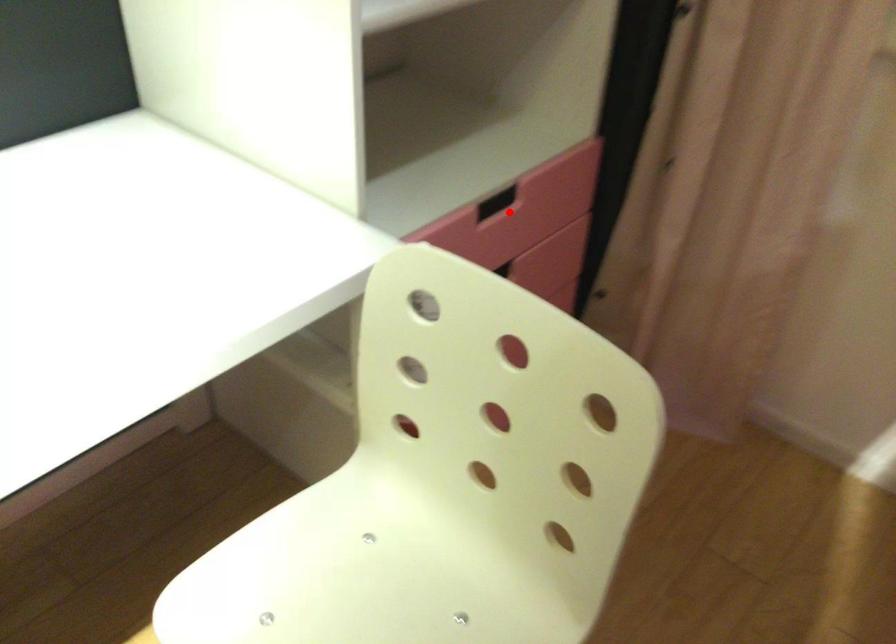
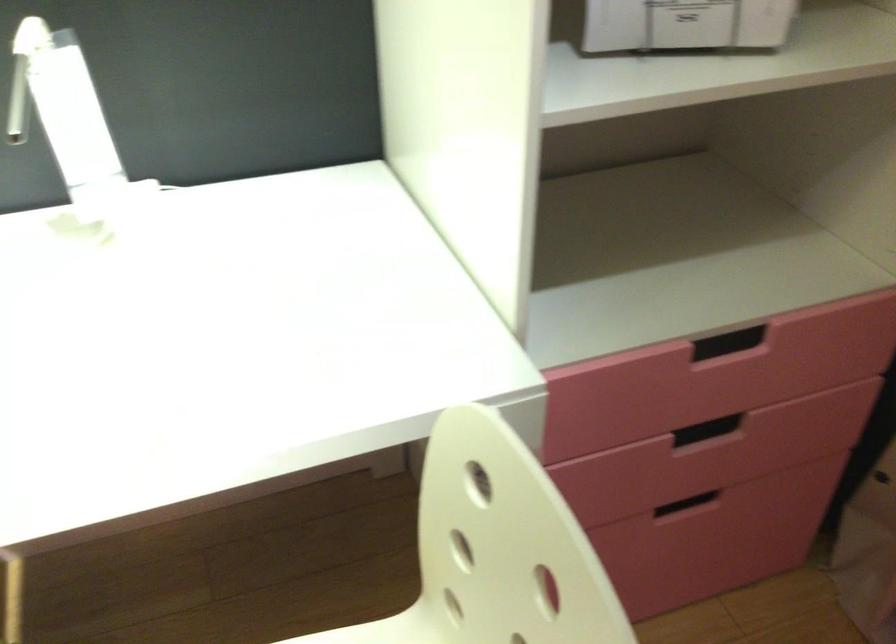
Question: I am providing you with two images of the same scene from different viewpoints. Given a red point in image1, look at the same physical point in image2. Is it:

Choices:
 (A) Closer to the viewpoint
 (B) Farther from the viewpoint

Answer: (A)